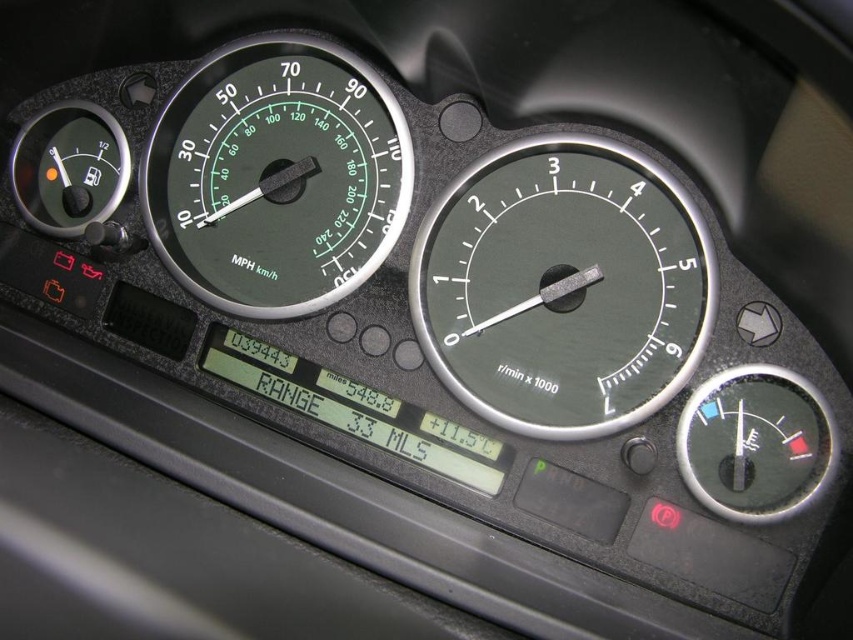
Question: Is matte black tachometer at center above green matte speedometer at center?

Choices:
 (A) yes
 (B) no

Answer: (B)

Question: Is matte black tachometer at center to the left of green matte speedometer at center from the viewer's perspective?

Choices:
 (A) no
 (B) yes

Answer: (A)

Question: Does matte black tachometer at center have a lesser width compared to green matte speedometer at center?

Choices:
 (A) no
 (B) yes

Answer: (B)

Question: Which point is closer to the camera?

Choices:
 (A) (149, 173)
 (B) (437, 228)

Answer: (B)

Question: Which object is farther from the camera taking this photo?

Choices:
 (A) green matte speedometer at center
 (B) matte black tachometer at center

Answer: (A)